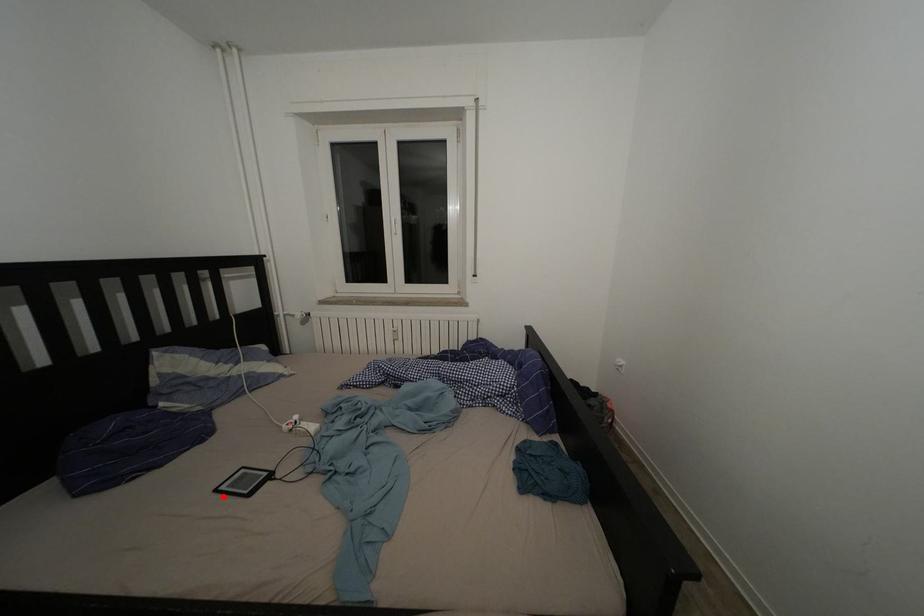
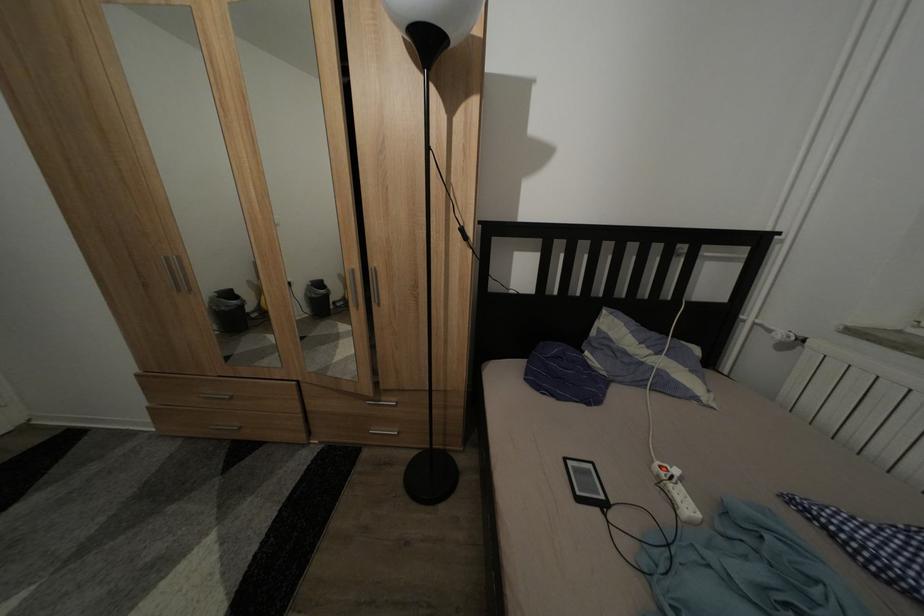
Where in the second image is the point corresponding to the highlighted location from the first image?

(573, 466)